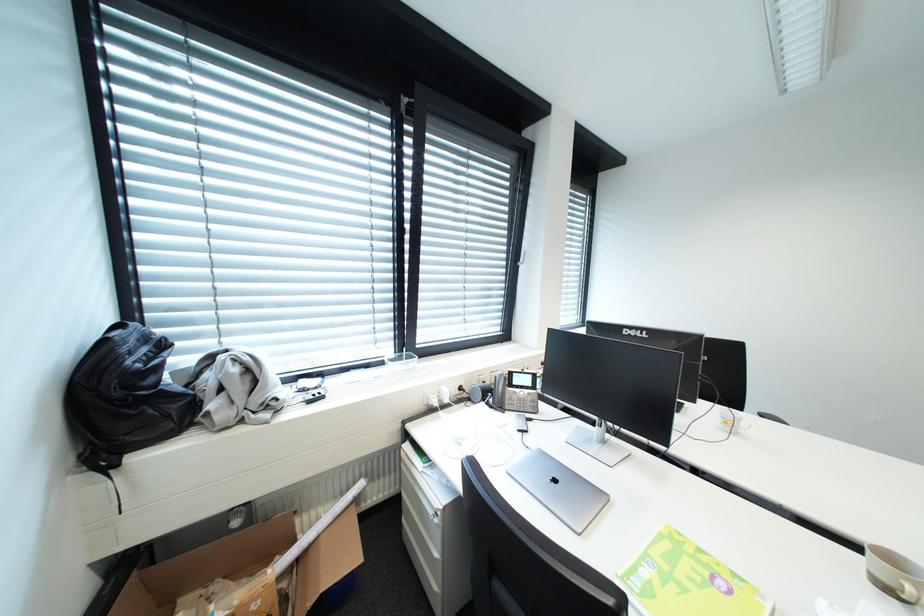
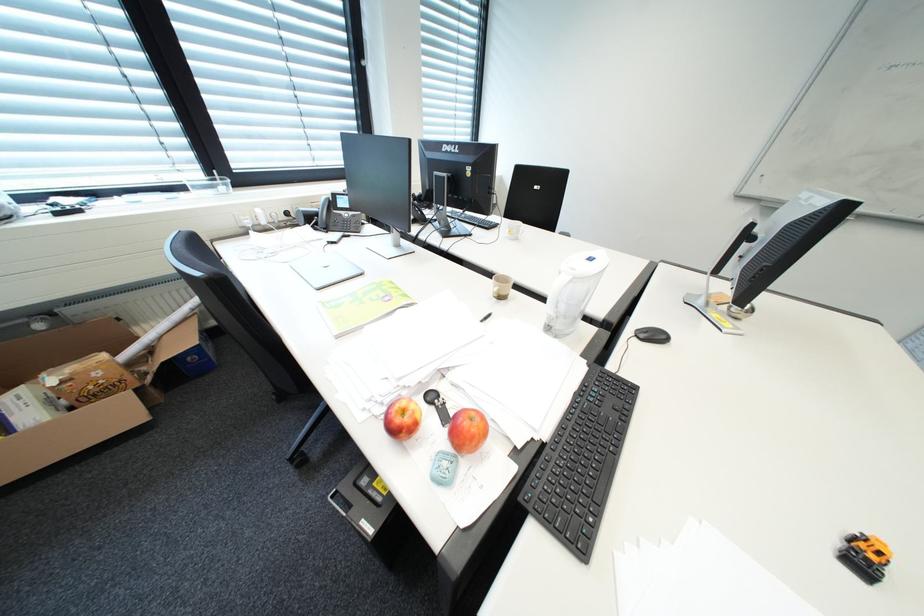
Question: The images are taken continuously from a first-person perspective. In which direction is your viewpoint rotating?

Choices:
 (A) Left
 (B) Right
 (C) Up
 (D) Down

Answer: (D)